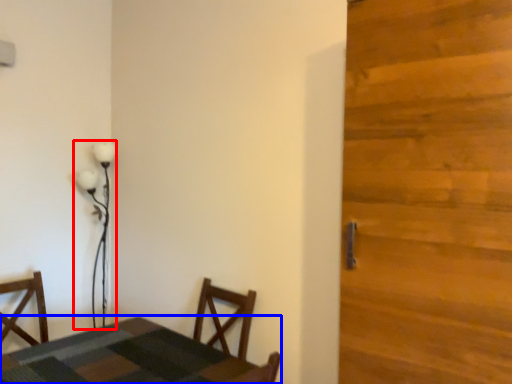
Question: Which object appears farthest to the camera in this image, lamp (highlighted by a red box) or table (highlighted by a blue box)?

Choices:
 (A) lamp
 (B) table

Answer: (A)